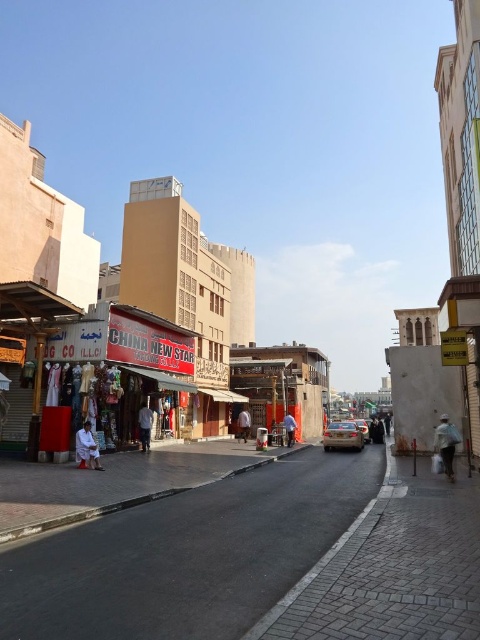
From the picture: You are standing on the street and see a white fabric person at lower left and a brown fabric person at center. Which one is nearer to you?

The white fabric person at lower left is closer to the viewer than brown fabric person at center.

You are a delivery person standing at the entrance of the shop with the red signboard. You need to place a package between the white cotton shirt at center and the orange fabric at center. The package requires 1 meter of space. Is there enough space between them to place the package?

The distance between the white cotton shirt at center and the orange fabric at center is 9.24 meters, which is more than enough to place the 1 meter package between them.